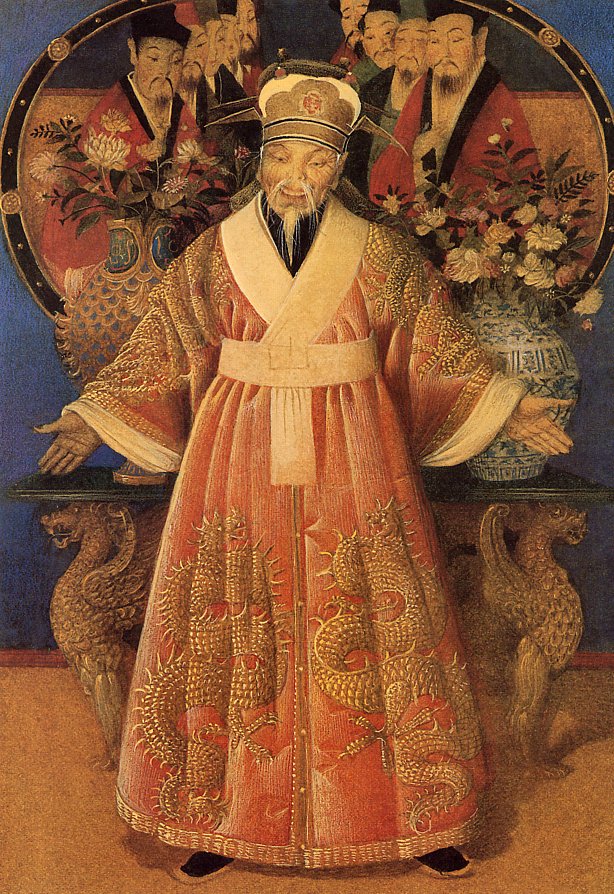
Where is `decor`? decor is located at coordinates (84, 628).